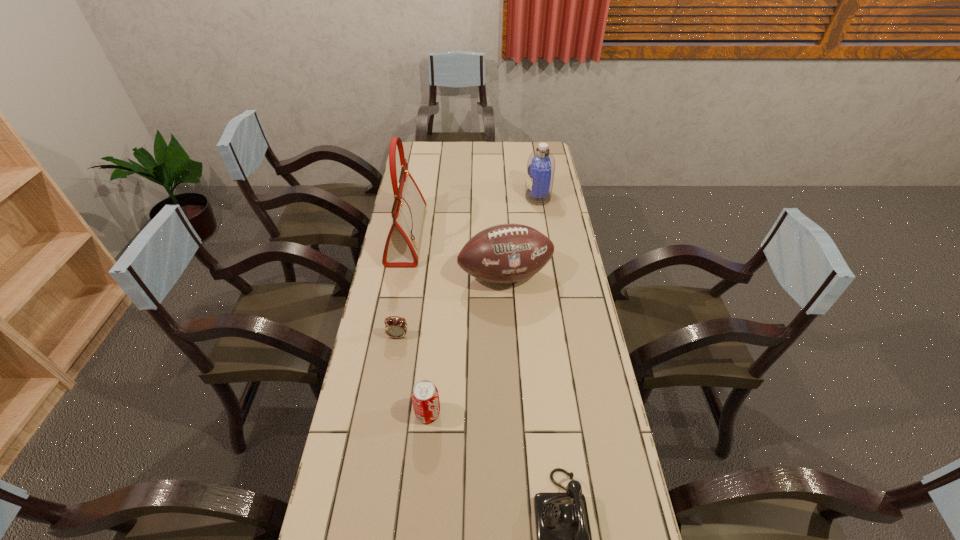
I want to click on the tallest object, so click(401, 248).

Where is `cleansing agent`? The width and height of the screenshot is (960, 540). cleansing agent is located at coordinates (541, 163).

The height and width of the screenshot is (540, 960). In order to click on football (American) in this screenshot , I will do `click(506, 253)`.

The width and height of the screenshot is (960, 540). Identify the location of the fourth tallest object. (425, 398).

This screenshot has height=540, width=960. I want to click on soda, so click(425, 398).

The image size is (960, 540). In order to click on alarm clock in this screenshot , I will do `click(394, 327)`.

You are a GUI agent. You are given a task and a screenshot of the screen. Output one action in this format:
    pyautogui.click(x=<x>, y=<y>)
    Task: Click on the vacant space positioned on the back of the handbag
    This screenshot has width=960, height=540.
    Given the screenshot: What is the action you would take?
    pyautogui.click(x=413, y=201)

Image resolution: width=960 pixels, height=540 pixels. Find the location of `vacant space positioned on the front of the cleansing agent`. vacant space positioned on the front of the cleansing agent is located at coordinates (542, 225).

Find the location of a particular element. This screenshot has width=960, height=540. free space located on the back of the football (American) is located at coordinates (502, 219).

Identify the location of blank area located on the right of the fifth farthest object. The image size is (960, 540). (512, 414).